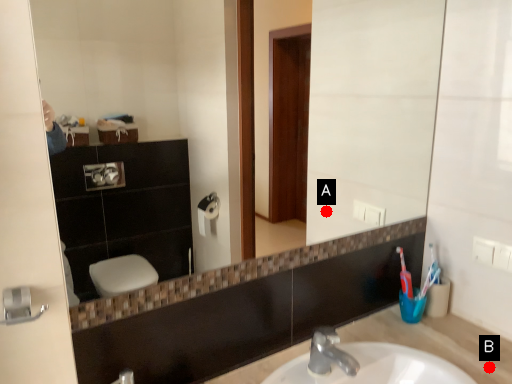
Question: Two points are circled on the image, labeled by A and B beside each circle. Which of the following is the closest to the observer?

Choices:
 (A) A is closer
 (B) B is closer

Answer: (B)